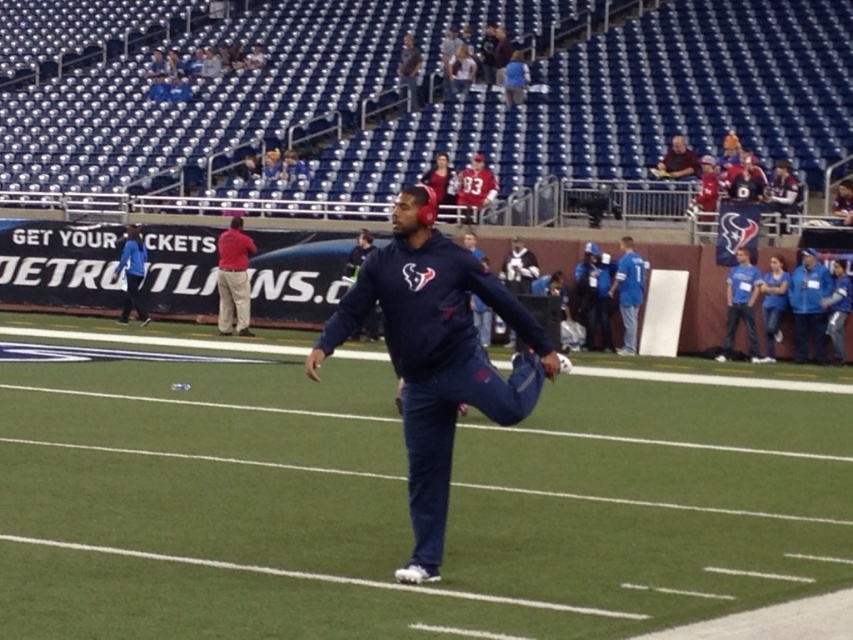
Question: Estimate the real-world distances between objects in this image. Which object is closer to the blue jersey at right?

Choices:
 (A) matte red jersey at upper center
 (B) blue fabric jacket at left

Answer: (A)

Question: Can you confirm if red cotton shirt at center is smaller than matte red jersey at upper center?

Choices:
 (A) no
 (B) yes

Answer: (A)

Question: Does matte red jersey at upper center lie behind blue fleece jacket at upper center?

Choices:
 (A) yes
 (B) no

Answer: (B)

Question: Which of the following is the farthest from the observer?

Choices:
 (A) coord(408,61)
 (B) coord(798,320)

Answer: (A)

Question: Does blue jersey at right appear on the right side of matte red jersey at upper center?

Choices:
 (A) yes
 (B) no

Answer: (A)

Question: Which object appears farthest from the camera in this image?

Choices:
 (A) blue fabric jacket at left
 (B) blue fabric jacket at right
 (C) matte red jersey at upper center
 (D) red cotton shirt at center

Answer: (A)